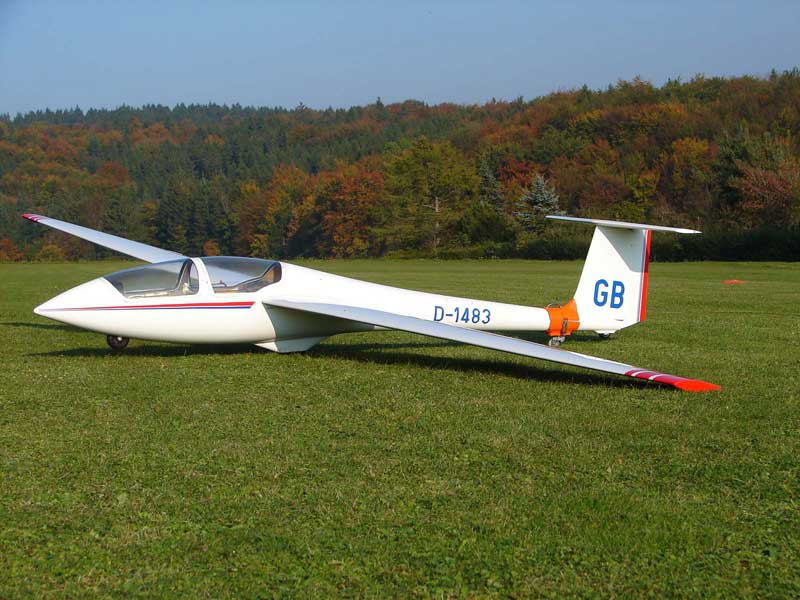
The height and width of the screenshot is (600, 800). Find the location of `2 seats`. 2 seats is located at coordinates (170, 285), (226, 279).